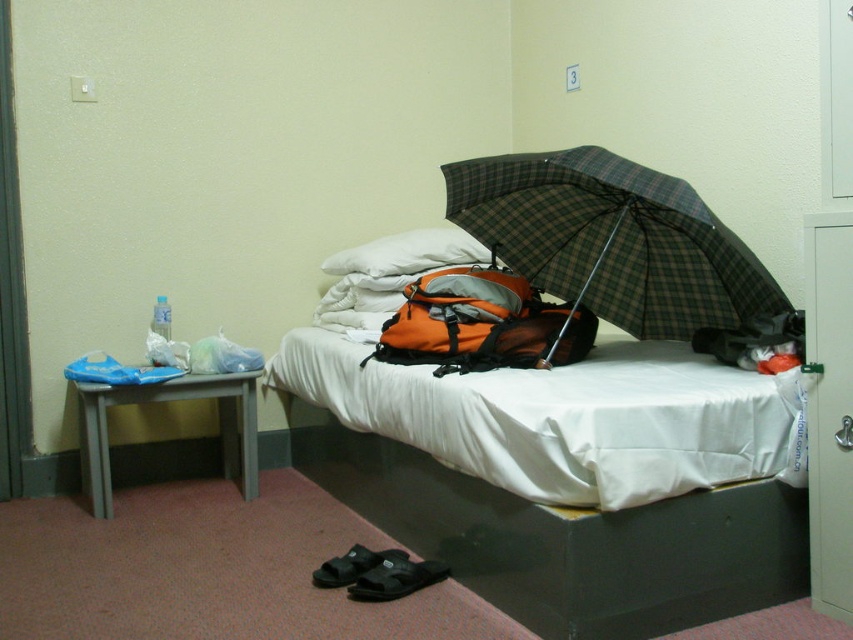
Question: Does black fabric slipper at lower center have a greater width compared to black fabric sandals at lower center?

Choices:
 (A) yes
 (B) no

Answer: (A)

Question: Which point is farther to the camera?

Choices:
 (A) white fabric bed at center
 (B) white soft pillow at center

Answer: (B)

Question: Which point appears farthest from the camera in this image?

Choices:
 (A) (117, 392)
 (B) (486, 330)

Answer: (A)

Question: Is white soft pillow at center positioned before black fabric sandals at lower center?

Choices:
 (A) no
 (B) yes

Answer: (A)

Question: Can you confirm if white fabric bed at center is bigger than black fabric sandals at lower center?

Choices:
 (A) yes
 (B) no

Answer: (A)

Question: Which object is positioned closest to the gray plastic stool at lower left?

Choices:
 (A) white fabric bed at center
 (B) black fabric sandals at lower center
 (C) white fabric mattress at center

Answer: (C)